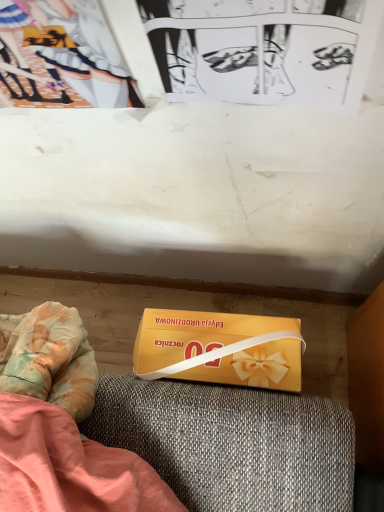
Question: Is black paper at upper center at the right side of yellow matte box at lower center?

Choices:
 (A) yes
 (B) no

Answer: (B)

Question: Is black paper at upper center bigger than yellow matte box at lower center?

Choices:
 (A) yes
 (B) no

Answer: (B)

Question: Could you tell me if black paper at upper center is facing yellow matte box at lower center?

Choices:
 (A) no
 (B) yes

Answer: (A)

Question: From a real-world perspective, is black paper at upper center beneath yellow matte box at lower center?

Choices:
 (A) no
 (B) yes

Answer: (A)

Question: Are black paper at upper center and yellow matte box at lower center far apart?

Choices:
 (A) yes
 (B) no

Answer: (B)

Question: Is yellow matte box at lower center bigger or smaller than black paper at upper center?

Choices:
 (A) small
 (B) big

Answer: (B)

Question: From a real-world perspective, is yellow matte box at lower center physically located above or below black paper at upper center?

Choices:
 (A) above
 (B) below

Answer: (B)

Question: Would you say yellow matte box at lower center is inside or outside black paper at upper center?

Choices:
 (A) outside
 (B) inside

Answer: (A)

Question: Does point (180, 318) appear closer or farther from the camera than point (152, 47)?

Choices:
 (A) farther
 (B) closer

Answer: (A)

Question: Considering their positions, is black paper at upper center located in front of or behind matte paper couple at upper left?

Choices:
 (A) behind
 (B) front

Answer: (B)

Question: Choose the correct answer: Is black paper at upper center inside matte paper couple at upper left or outside it?

Choices:
 (A) inside
 (B) outside

Answer: (B)

Question: In the image, is black paper at upper center on the left side or the right side of matte paper couple at upper left?

Choices:
 (A) left
 (B) right

Answer: (B)

Question: From the image's perspective, is black paper at upper center positioned above or below matte paper couple at upper left?

Choices:
 (A) below
 (B) above

Answer: (A)

Question: Based on their positions, is black paper at upper center located to the left or right of yellow matte box at lower center?

Choices:
 (A) left
 (B) right

Answer: (A)

Question: From a real-world perspective, relative to yellow matte box at lower center, is black paper at upper center vertically above or below?

Choices:
 (A) above
 (B) below

Answer: (A)